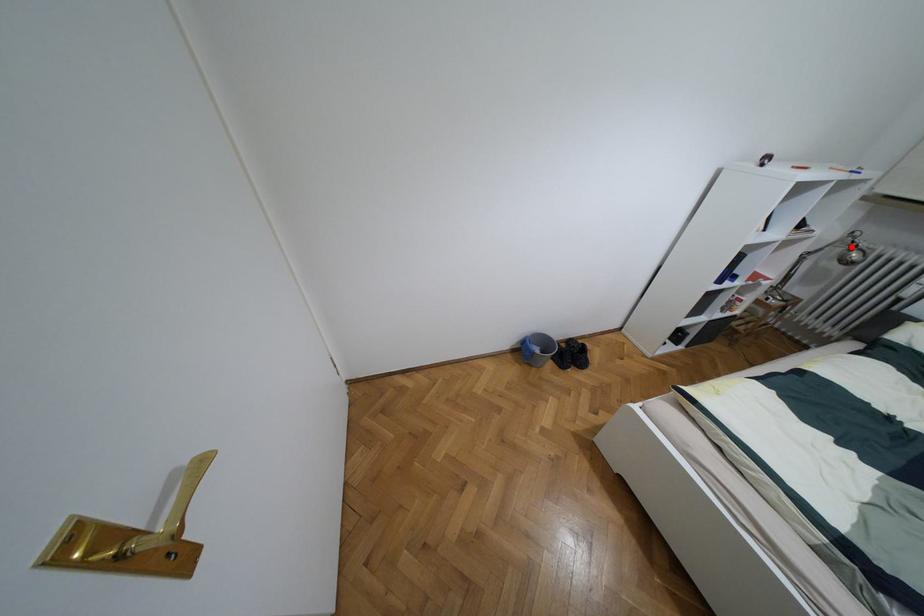
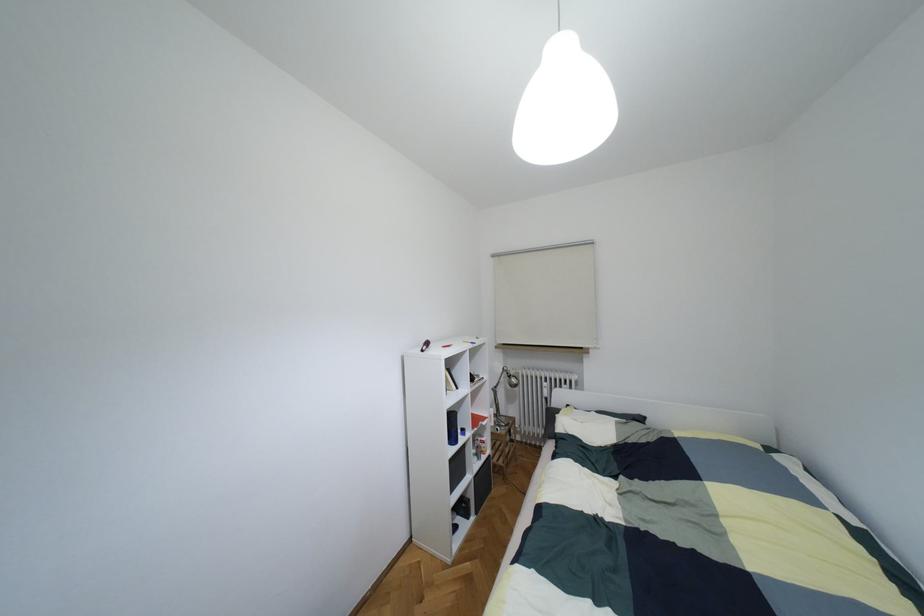
The point at the highlighted location is marked in the first image. Where is the corresponding point in the second image?

(508, 376)